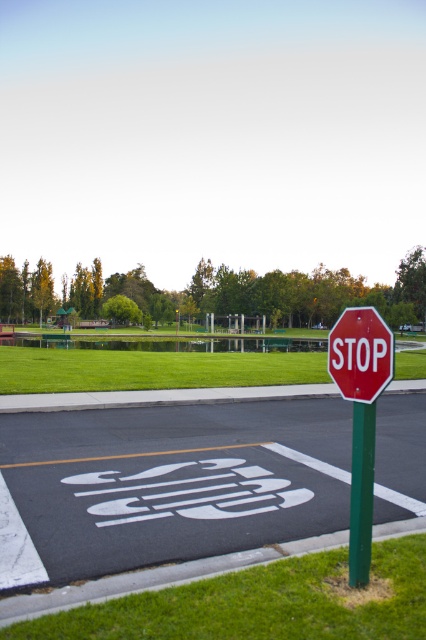
Does white painted stop sign at center have a lesser height compared to green grass at lower center?

No.

Who is higher up, white painted stop sign at center or green grass at lower center?

green grass at lower center is above.

Between point (83, 516) and point (414, 602), which one is positioned in front?

Positioned in front is point (414, 602).

The width and height of the screenshot is (426, 640). What are the coordinates of `white painted stop sign at center` in the screenshot? It's located at (169, 483).

Is white painted stop sign at center bigger than green metallic pole at right?

Yes.

Can you confirm if white painted stop sign at center is taller than green metallic pole at right?

No, white painted stop sign at center is not taller than green metallic pole at right.

This screenshot has height=640, width=426. What are the coordinates of `white painted stop sign at center` in the screenshot? It's located at (169, 483).

Identify the location of white painted stop sign at center. (169, 483).

Does white painted stop sign at center come in front of green grass at center?

Yes, white painted stop sign at center is in front of green grass at center.

Between white painted stop sign at center and green grass at center, which one appears on the left side from the viewer's perspective?

From the viewer's perspective, white painted stop sign at center appears more on the left side.

Between point (411, 474) and point (14, 378), which one is positioned in front?

Point (411, 474)

The image size is (426, 640). In order to click on white painted stop sign at center in this screenshot , I will do `click(169, 483)`.